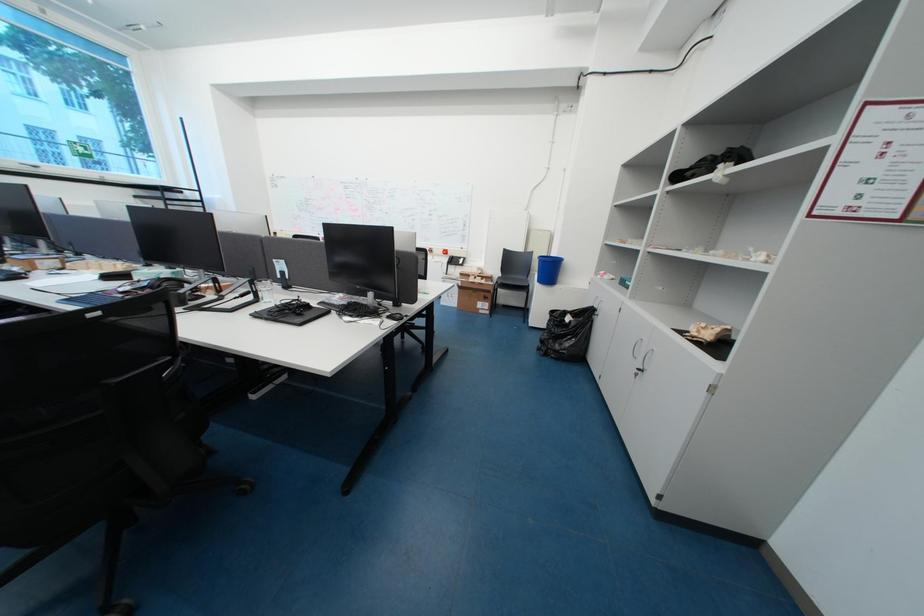
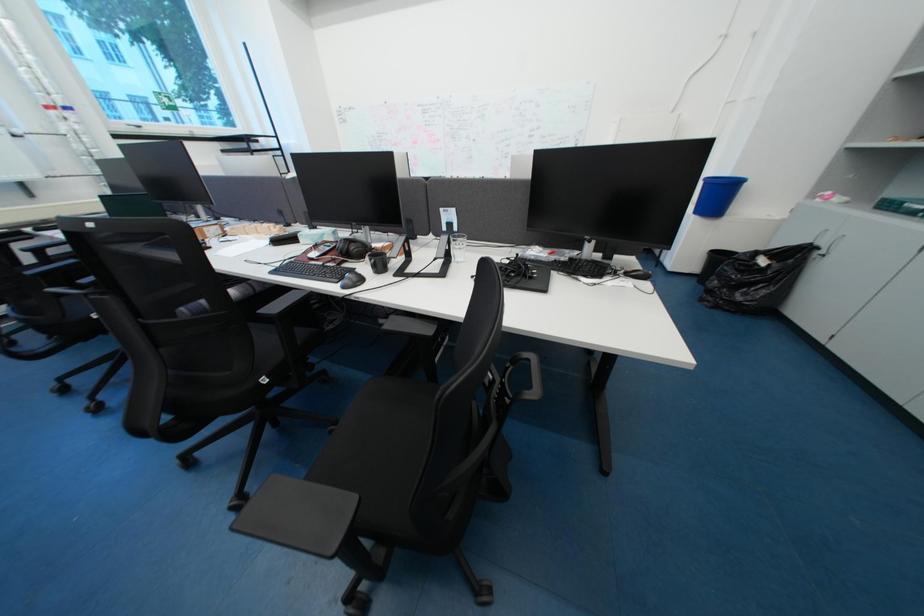
Question: Which direction would the cameraman need to move to produce the second image? Reply with the corresponding letter.

Choices:
 (A) Left
 (B) Right
 (C) Forward
 (D) Backward

Answer: (A)